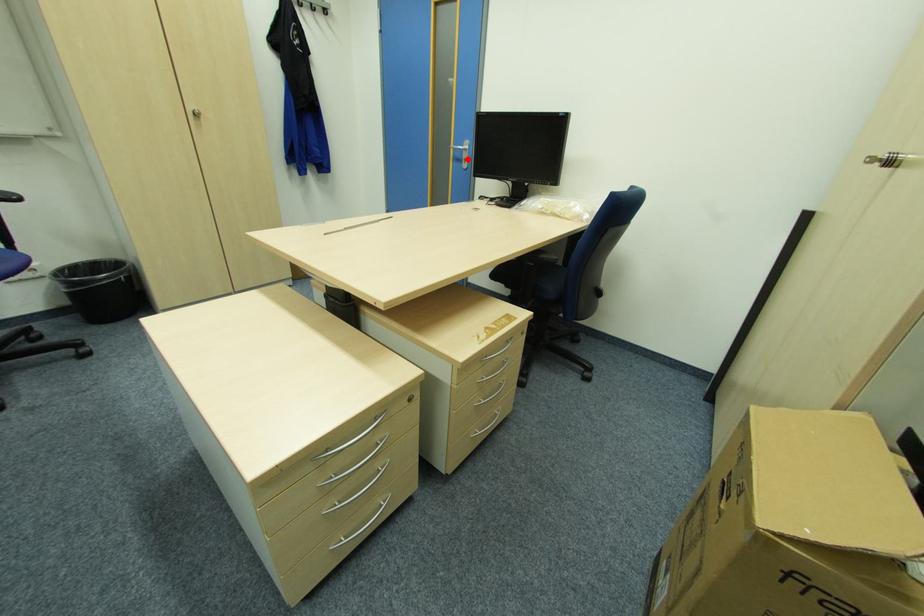
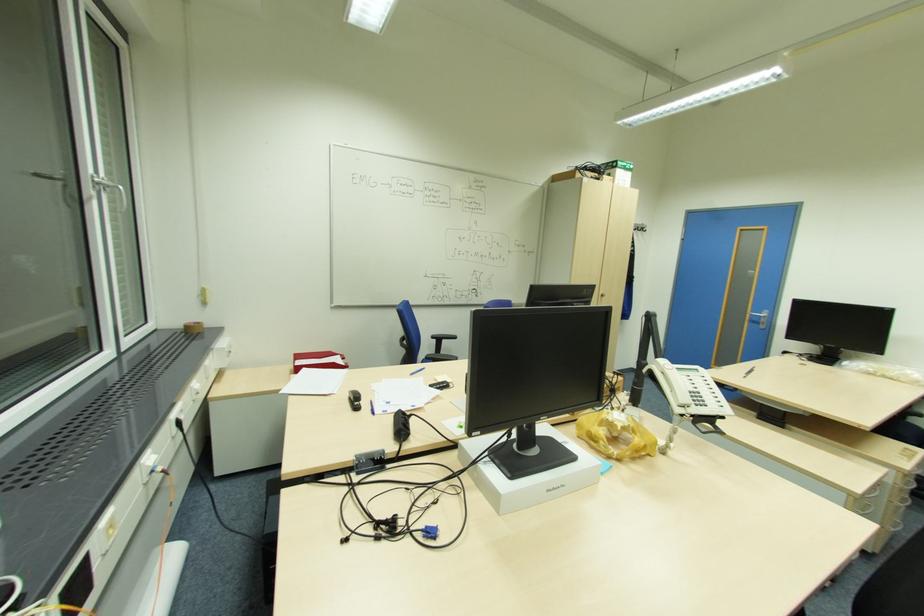
Question: I am providing you with two images of the same scene from different viewpoints. A red point is marked on the first image. Is the red point's position out of view in image 2?

Choices:
 (A) Yes
 (B) No

Answer: (B)